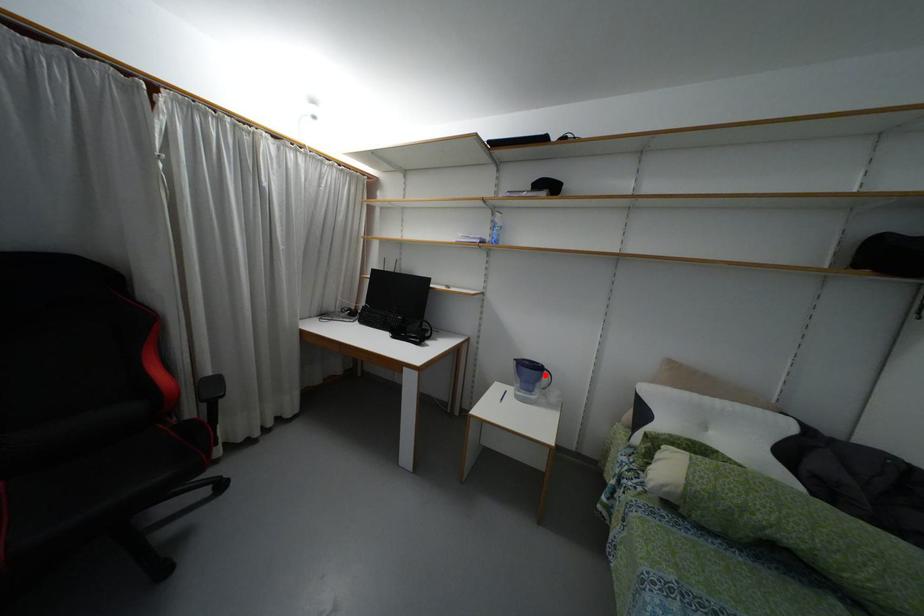
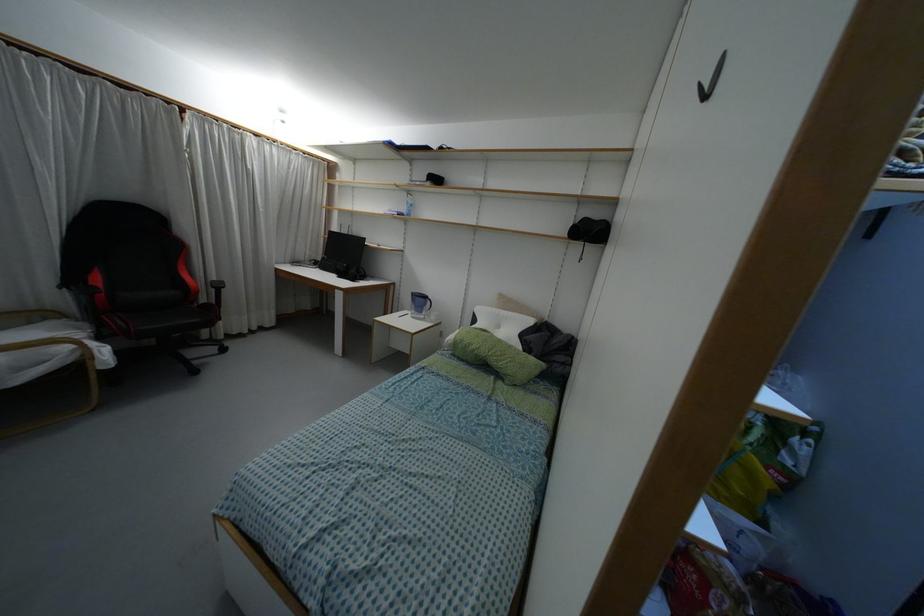
Where in the second image is the point corresponding to the highlighted location from the first image?

(428, 302)